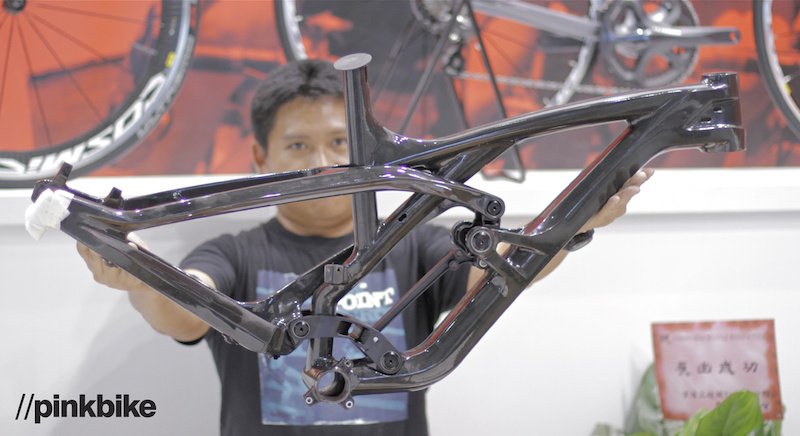
At what (x,y) coordinates should I click in order to perform the action: click on wall. Please return your answer as a coordinate pair (x, y). This screenshot has height=436, width=800. Looking at the image, I should click on (586, 344), (198, 122).